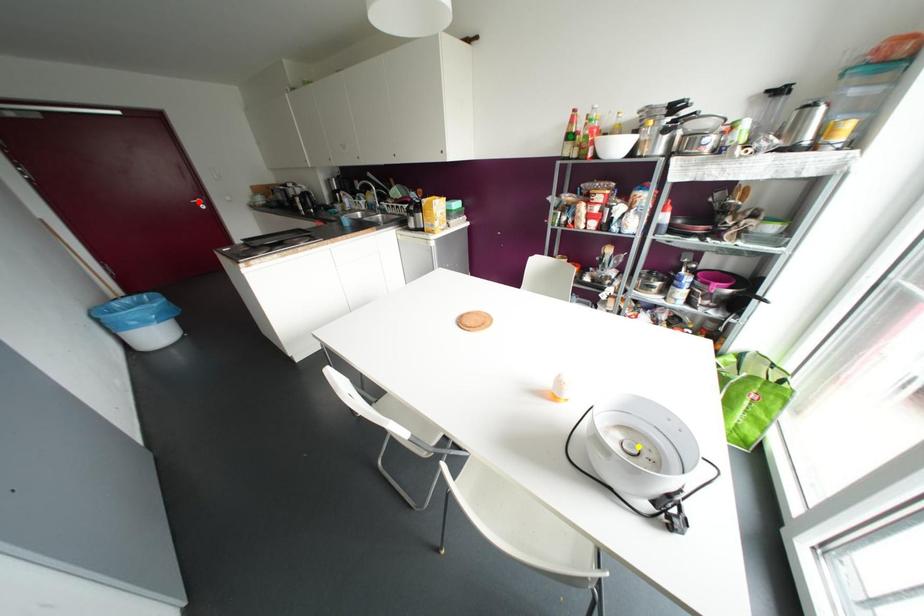
Order these from nearest to farthest:
A) green point
B) red point
C) yellow point

yellow point
green point
red point